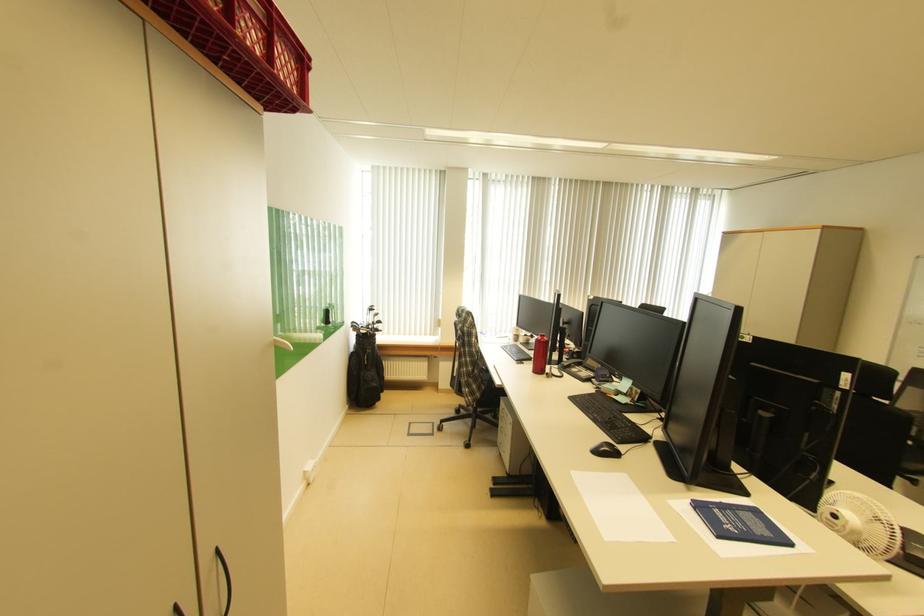
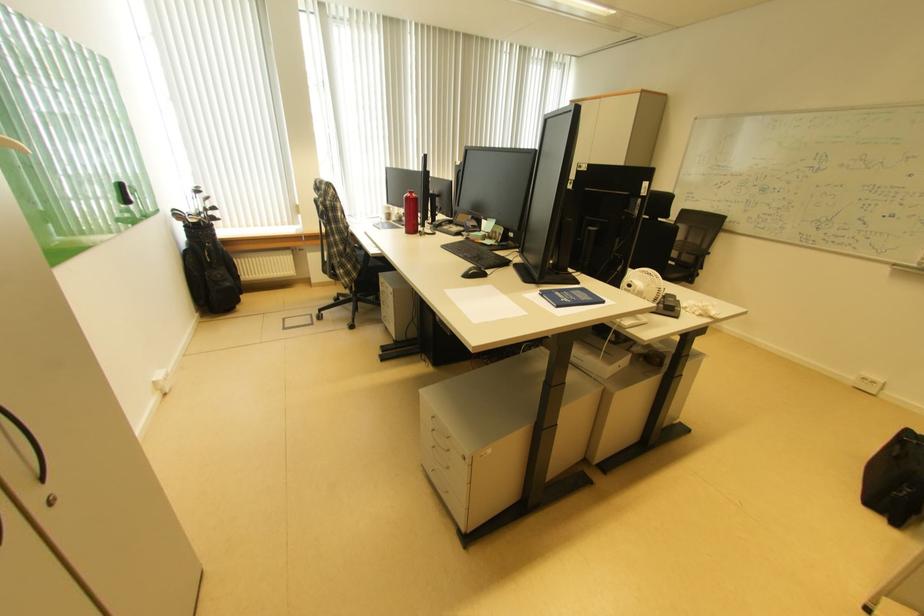
Locate, in the second image, the point that corresponds to point (533, 342) in the first image.

(407, 221)